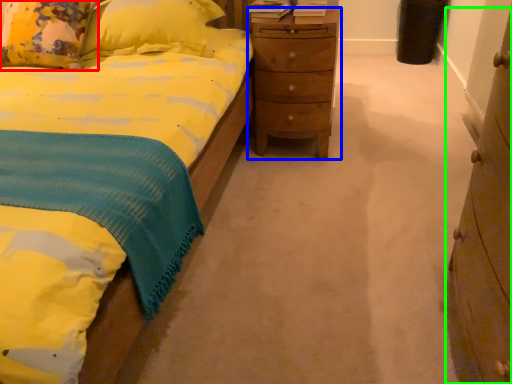
Question: Which is nearer to the pillow (highlighted by a red box)? nightstand (highlighted by a blue box) or chest of drawers (highlighted by a green box).

Choices:
 (A) nightstand
 (B) chest of drawers

Answer: (A)